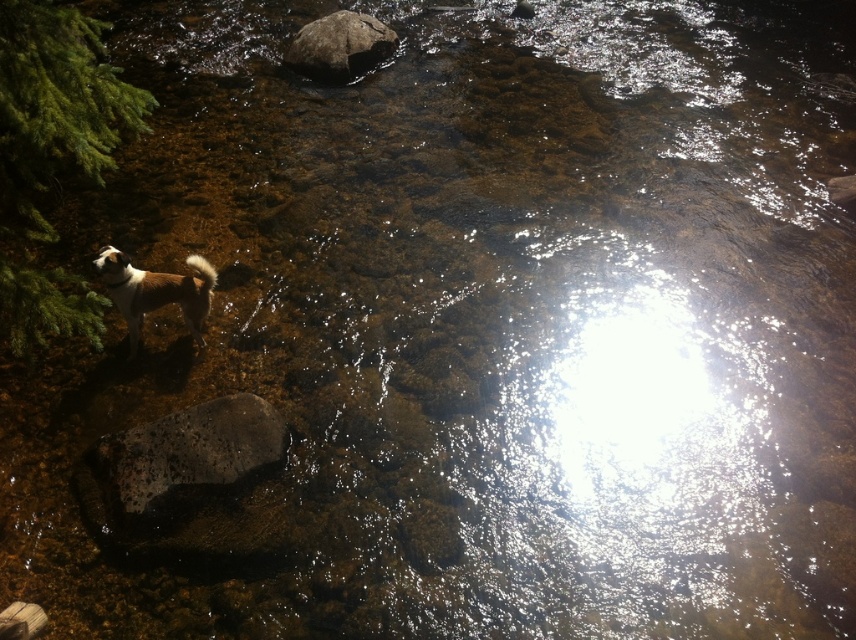
Question: Which point is farther to the camera?

Choices:
 (A) (149, 307)
 (B) (206, 492)
 (C) (324, 20)

Answer: (C)

Question: Is brown fur dog at left thinner than smooth gray rock at upper center?

Choices:
 (A) no
 (B) yes

Answer: (B)

Question: Observing the image, what is the correct spatial positioning of speckled gray rock at center in reference to brown fur dog at left?

Choices:
 (A) above
 (B) below

Answer: (B)

Question: Based on their relative distances, which object is nearer to the smooth gray rock at upper center?

Choices:
 (A) brown fur dog at left
 (B) speckled gray rock at center

Answer: (A)

Question: Which point appears closest to the camera in this image?

Choices:
 (A) (241, 420)
 (B) (140, 326)

Answer: (A)

Question: Can you confirm if speckled gray rock at center is positioned below smooth gray rock at upper center?

Choices:
 (A) yes
 (B) no

Answer: (A)